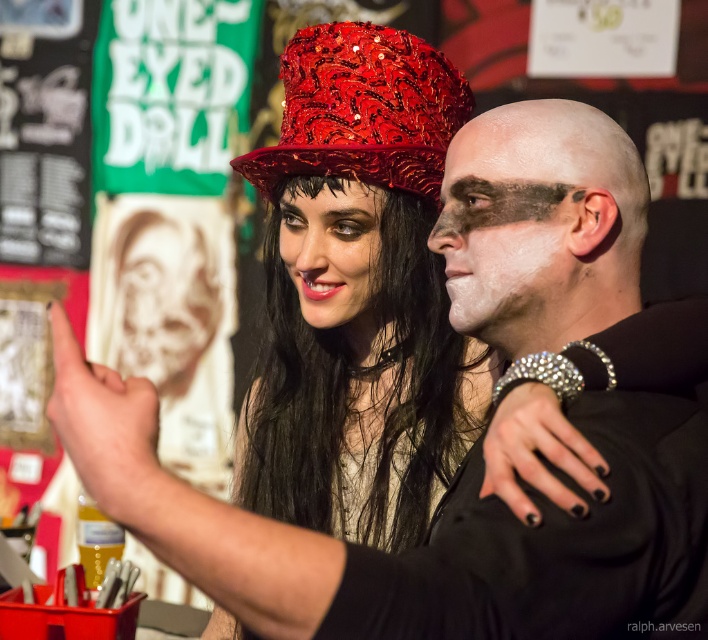
The height and width of the screenshot is (640, 708). What do you see at coordinates (362, 109) in the screenshot?
I see `shiny sequined hat at upper center` at bounding box center [362, 109].

Find the location of a particular element. shiny sequined hat at upper center is located at coordinates (362, 109).

Who is more forward, (319, 33) or (299, 268)?

Positioned in front is point (319, 33).

Is shiny sequined hat at center closer to camera compared to matte black face at center?

That is True.

Where is `shiny sequined hat at center`? shiny sequined hat at center is located at coordinates (358, 294).

Which is more to the right, shiny sequined hat at center or white matte face at center?

From the viewer's perspective, white matte face at center appears more on the right side.

Where is `shiny sequined hat at center`? Image resolution: width=708 pixels, height=640 pixels. shiny sequined hat at center is located at coordinates (358, 294).

The width and height of the screenshot is (708, 640). Find the location of `shiny sequined hat at center`. shiny sequined hat at center is located at coordinates (358, 294).